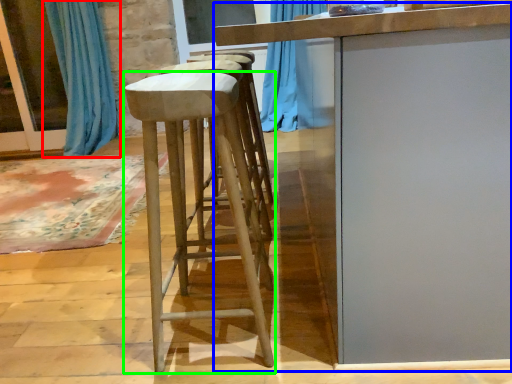
Question: Which object is the closest to the curtain (highlighted by a red box)? Choose among these: table (highlighted by a blue box) or stool (highlighted by a green box).

Choices:
 (A) table
 (B) stool

Answer: (B)